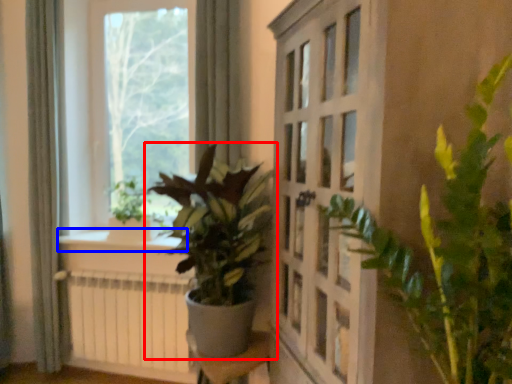
Question: Among these objects, which one is farthest to the camera, houseplant (highlighted by a red box) or window sill (highlighted by a blue box)?

Choices:
 (A) houseplant
 (B) window sill

Answer: (B)